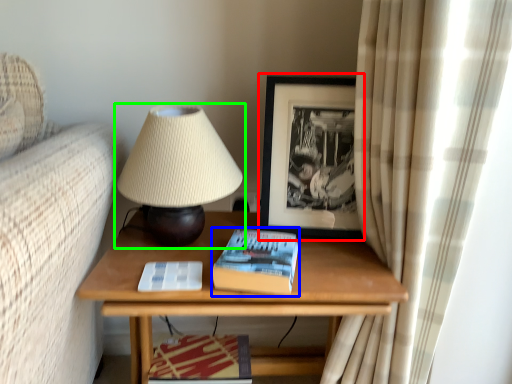
Question: Which object is the farthest from picture frame (highlighted by a red box)? Choose among these: paperback book (highlighted by a blue box) or lamp (highlighted by a green box).

Choices:
 (A) paperback book
 (B) lamp

Answer: (A)